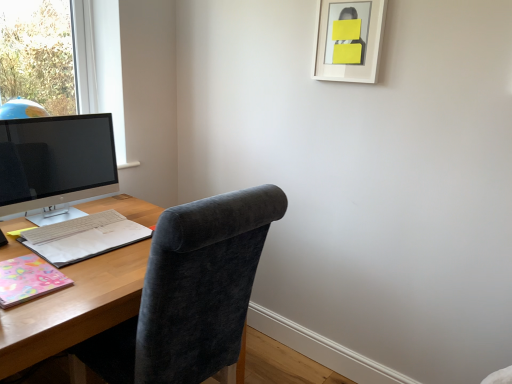
In order to click on empty space that is ontop of pastel floral paper at lower left, the first notebook from the front (from a real-world perspective) in this screenshot , I will do `click(27, 271)`.